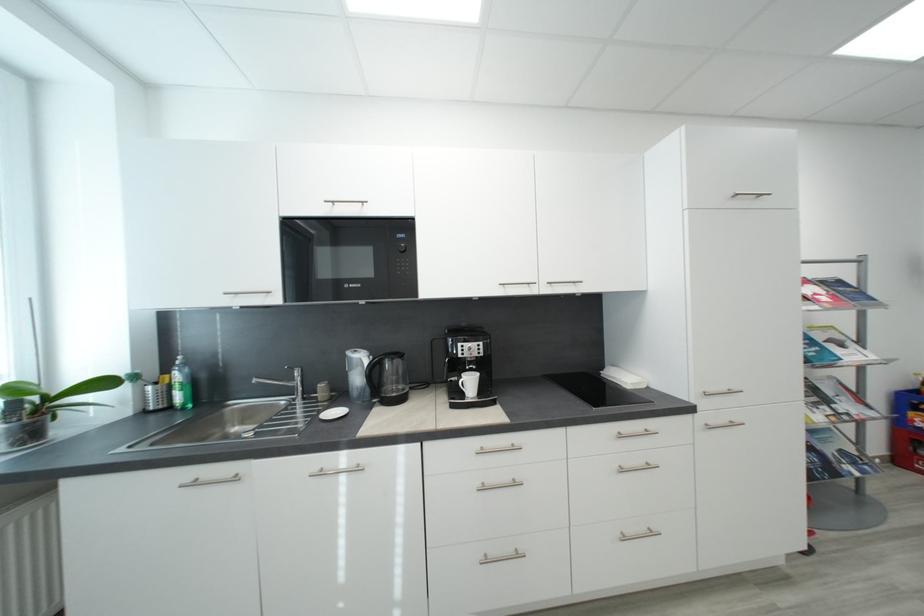
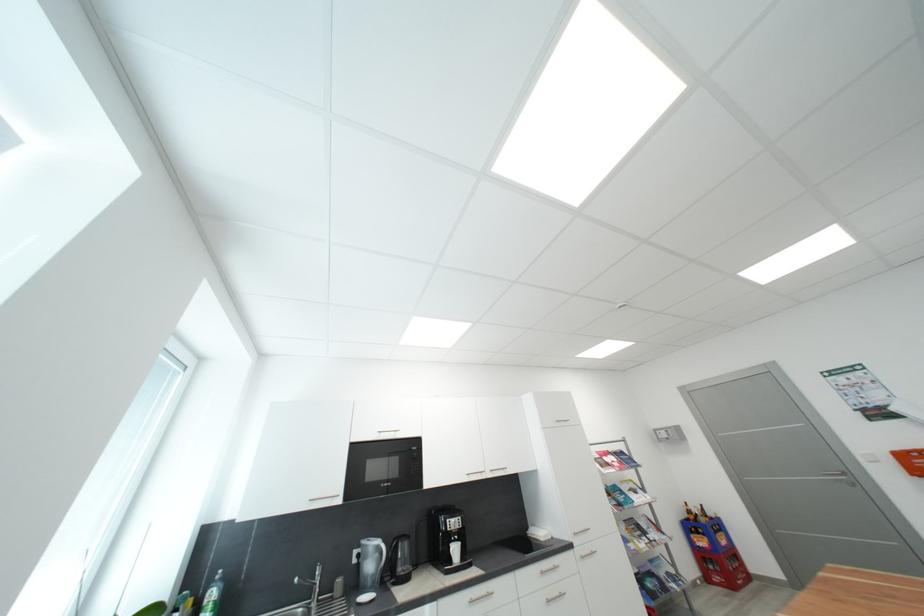
Locate, in the second image, the point that corresponds to [477,384] in the first image.

(463, 552)